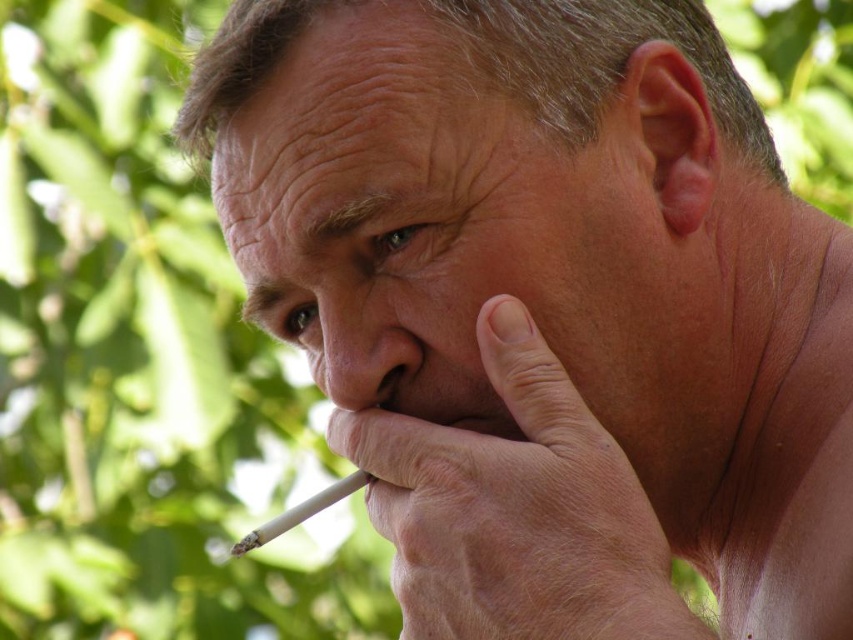
Looking at this image, between green leafy tree at left and white matte cigarette at lower center, which one is positioned lower?

white matte cigarette at lower center

Which of these two, green leafy tree at left or white matte cigarette at lower center, stands taller?

With more height is green leafy tree at left.

This screenshot has height=640, width=853. Find the location of `green leafy tree at left`. green leafy tree at left is located at coordinates (143, 364).